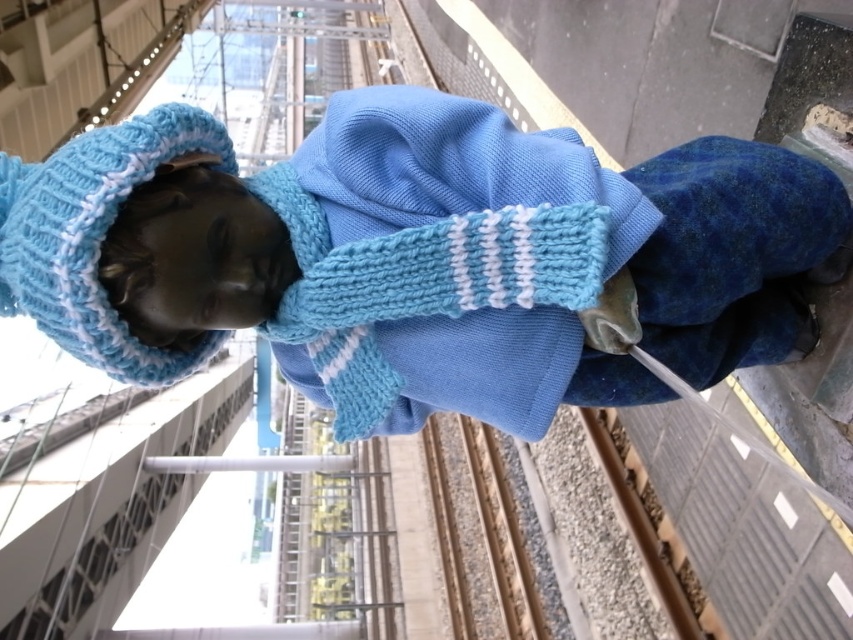
Question: Considering the relative positions of knitted blue sweater at center and brown gravel train track at lower center in the image provided, where is knitted blue sweater at center located with respect to brown gravel train track at lower center?

Choices:
 (A) below
 (B) above

Answer: (B)

Question: Is the position of knitted blue sweater at center more distant than that of brown gravel train track at lower center?

Choices:
 (A) no
 (B) yes

Answer: (A)

Question: Is knitted blue sweater at center wider than brown gravel train track at lower center?

Choices:
 (A) yes
 (B) no

Answer: (A)

Question: Which of the following is the closest to the observer?

Choices:
 (A) (635, 504)
 (B) (451, 262)

Answer: (B)

Question: Which point is closer to the camera taking this photo?

Choices:
 (A) (590, 417)
 (B) (498, 282)

Answer: (B)